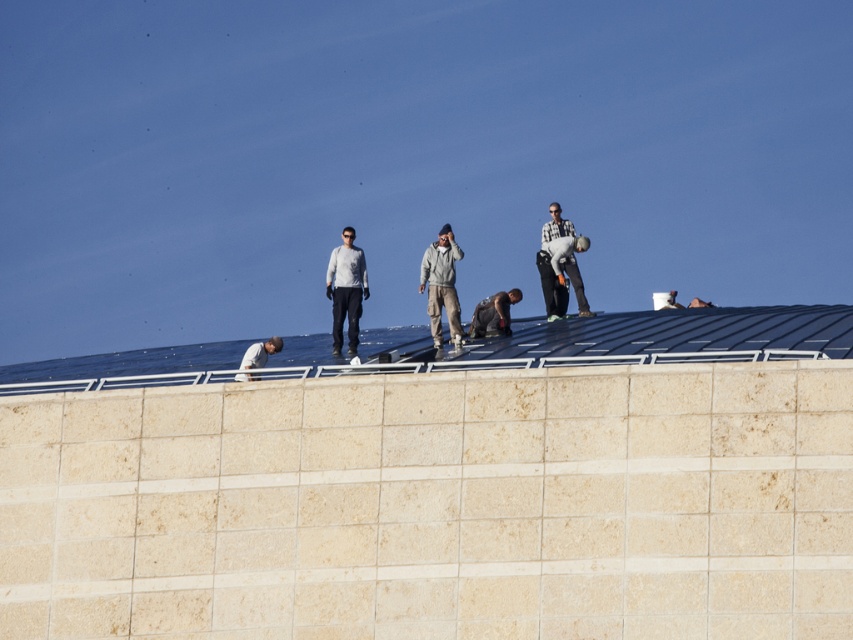
Does denim pants at center appear on the right side of light gray fabric shirt at lower left?

Correct, you'll find denim pants at center to the right of light gray fabric shirt at lower left.

Is point (546, 292) closer to camera compared to point (250, 355)?

That is False.

Is point (575, 250) positioned after point (248, 358)?

Yes, point (575, 250) is behind point (248, 358).

The height and width of the screenshot is (640, 853). Find the location of `denim pants at center`. denim pants at center is located at coordinates (561, 275).

Does point (341, 298) come in front of point (514, 300)?

Yes, it is in front of point (514, 300).

Between light gray sweater at center and dark gray fabric shirt at center, which one appears on the left side from the viewer's perspective?

light gray sweater at center is more to the left.

Is point (364, 278) positioned behind point (502, 317)?

Yes, it is behind point (502, 317).

Identify the location of light gray sweater at center. The image size is (853, 640). (346, 289).

Consider the image. Who is positioned more to the left, dark gray fabric shirt at center or light gray fabric shirt at lower left?

Positioned to the left is light gray fabric shirt at lower left.

Which is above, dark gray fabric shirt at center or light gray fabric shirt at lower left?

dark gray fabric shirt at center is higher up.

Between point (480, 307) and point (244, 365), which one is positioned in front?

Positioned in front is point (244, 365).

You are a GUI agent. You are given a task and a screenshot of the screen. Output one action in this format:
    pyautogui.click(x=<x>, y=<y>)
    Task: Click on the dark gray fabric shirt at center
    The image size is (853, 640).
    Given the screenshot: What is the action you would take?
    pyautogui.click(x=492, y=314)